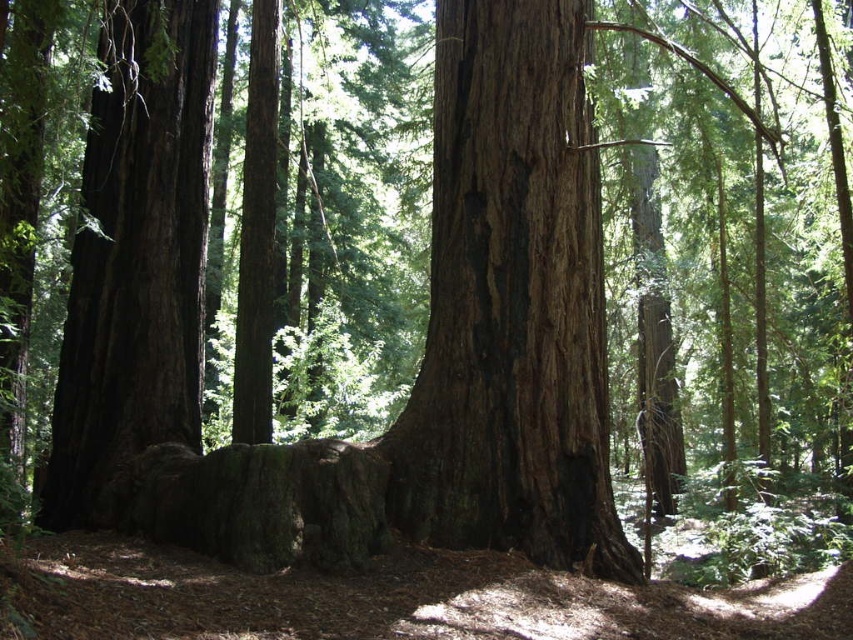
Is dark brown rough bark tree trunk at center closer to camera compared to dark brown wood at left?

Yes, it is in front of dark brown wood at left.

Where is `dark brown rough bark tree trunk at center`? This screenshot has width=853, height=640. dark brown rough bark tree trunk at center is located at coordinates (511, 304).

Which is in front, point (569, 97) or point (99, 209)?

Positioned in front is point (569, 97).

Where is `dark brown rough bark tree trunk at center`? dark brown rough bark tree trunk at center is located at coordinates (511, 304).